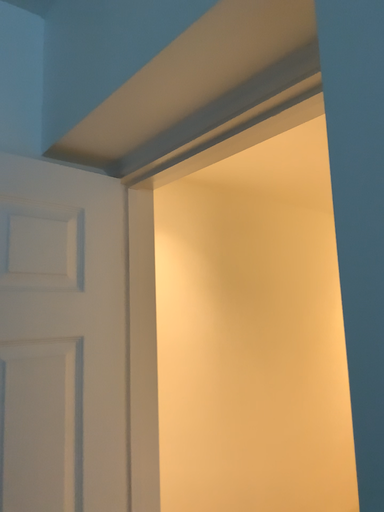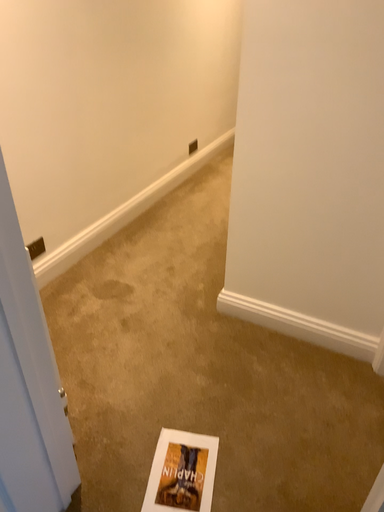
Question: How did the camera likely rotate when shooting the video?

Choices:
 (A) rotated downward
 (B) rotated upward

Answer: (A)